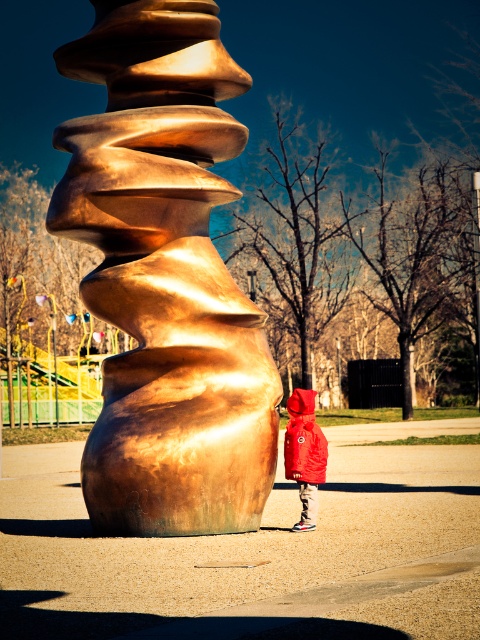
You are a photographer trying to capture the sculpture and the child in the same frame. Based on the scene, will the gold polished spiral at center and the matte red jacket at center fit in the same photo if your camera has a standard 50mm lens?

The gold polished spiral at center is much taller than the matte red jacket at center, but since both are at the center, they should fit in the same frame with a standard 50mm lens as long as the photographer positions themselves far enough back to include both the large sculpture and the child in the composition.